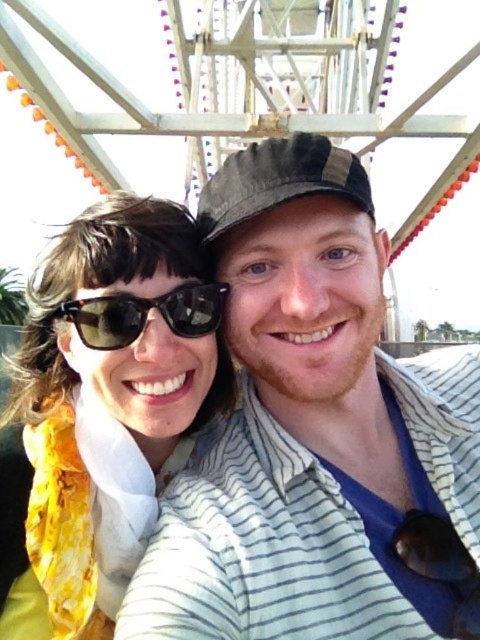
You are a photographer trying to capture a closeup of the yellow fabric scarf at left and the black reflective sunglasses at center. Given that your camera can focus on objects within a 10 foot range, will both items be in focus?

The yellow fabric scarf at left and black reflective sunglasses at center are 10.72 feet apart. Since the camera can only focus within 10 feet, the distance between them exceeds the focus range, so they might not both be in focus simultaneously.

You are standing at a point 37.28 meters away from the Ferris wheel in the image. If you want to take a selfie with the Ferris wheel as the background, would the point marked as point (99, 356) in the image be a suitable spot? Please explain why.

The point marked as point (99, 356) is exactly 37.28 meters away from the viewer. Since you are already standing at that distance, this spot would be suitable for taking a selfie with the Ferris wheel as the background.

You are a photographer trying to capture a closeup of the yellow fabric scarf at left and the black reflective sunglasses at center. Which object should you zoom in on to ensure both fit in the frame without cropping?

The yellow fabric scarf at left is wider than the black reflective sunglasses at center, so you should zoom in on the black reflective sunglasses at center to ensure both fit in the frame without cropping.